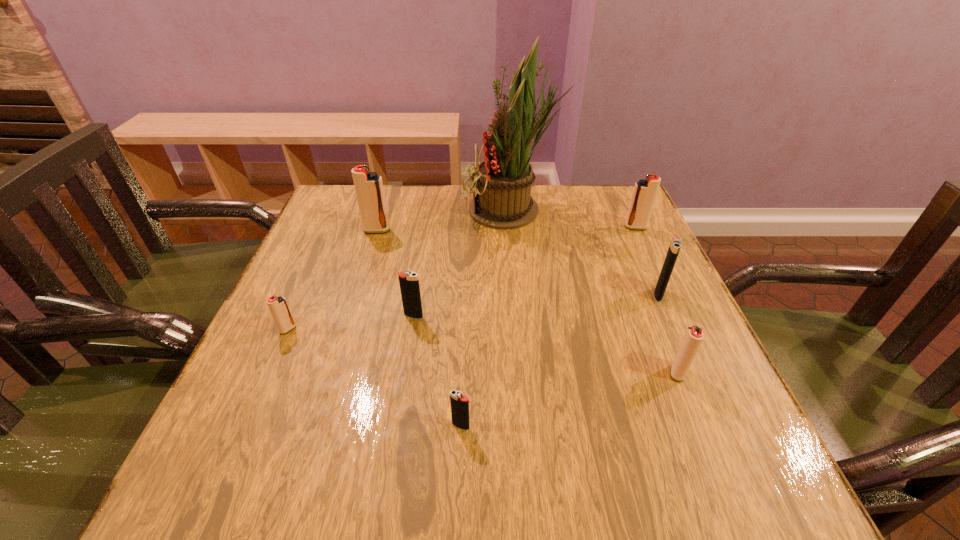
Identify the location of vacant space at the right edge. (636, 369).

Where is `vacant point at the far left corner`? The height and width of the screenshot is (540, 960). vacant point at the far left corner is located at coordinates (354, 218).

Locate an element on the screen. The width and height of the screenshot is (960, 540). unoccupied position between the third igniter from right to left and the tallest object is located at coordinates (594, 292).

Where is `empty location between the third red igniter from left to right and the third farthest igniter`? empty location between the third red igniter from left to right and the third farthest igniter is located at coordinates (668, 333).

The height and width of the screenshot is (540, 960). Find the location of `free space between the third smallest red igniter and the smallest red igniter`. free space between the third smallest red igniter and the smallest red igniter is located at coordinates (462, 278).

In order to click on vacant area that lies between the leftmost igniter and the nearest black igniter in this screenshot , I will do `click(374, 377)`.

Locate an element on the screen. The width and height of the screenshot is (960, 540). vacant point located between the third object from left to right and the sixth igniter from right to left is located at coordinates (396, 273).

Locate an element on the screen. blank region between the biggest red igniter and the tallest object is located at coordinates (444, 220).

This screenshot has height=540, width=960. What are the coordinates of `vacant space that is in between the leftmost black igniter and the biggest black igniter` in the screenshot? It's located at (536, 305).

This screenshot has width=960, height=540. I want to click on vacant space in between the second black igniter from right to left and the fourth farthest object, so click(560, 360).